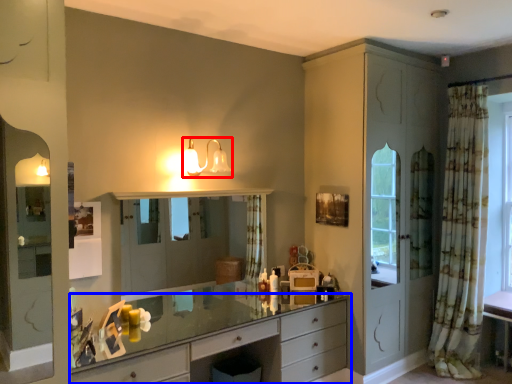
Question: Which point is further to the camera, light fixture (highlighted by a red box) or chest of drawers (highlighted by a blue box)?

Choices:
 (A) light fixture
 (B) chest of drawers

Answer: (A)